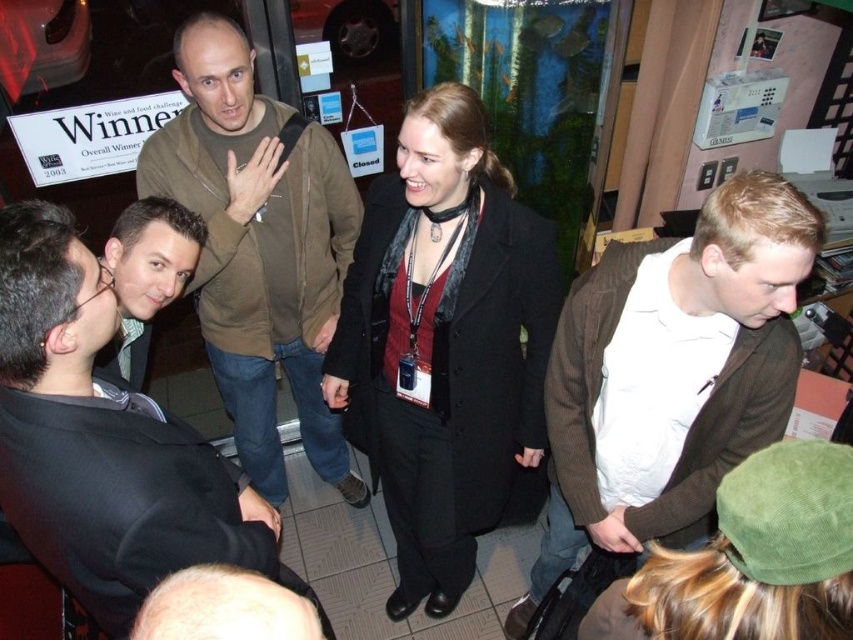
Question: Estimate the real-world distances between objects in this image. Which object is closer to the black suit at left?

Choices:
 (A) brown corduroy sweater at center
 (B) brown corduroy jacket at center

Answer: (B)

Question: Which object is closer to the camera taking this photo?

Choices:
 (A) black suit at left
 (B) brown corduroy jacket at center
 (C) brown corduroy sweater at center

Answer: (A)

Question: From the image, what is the correct spatial relationship of brown corduroy sweater at center in relation to brown corduroy jacket at center?

Choices:
 (A) left
 (B) right

Answer: (B)

Question: Does brown corduroy sweater at center appear over brown corduroy jacket at center?

Choices:
 (A) no
 (B) yes

Answer: (A)

Question: Based on their relative distances, which object is nearer to the black suit at left?

Choices:
 (A) brown corduroy jacket at center
 (B) brown corduroy sweater at center

Answer: (A)

Question: Is black suit at left smaller than brown corduroy jacket at center?

Choices:
 (A) no
 (B) yes

Answer: (B)